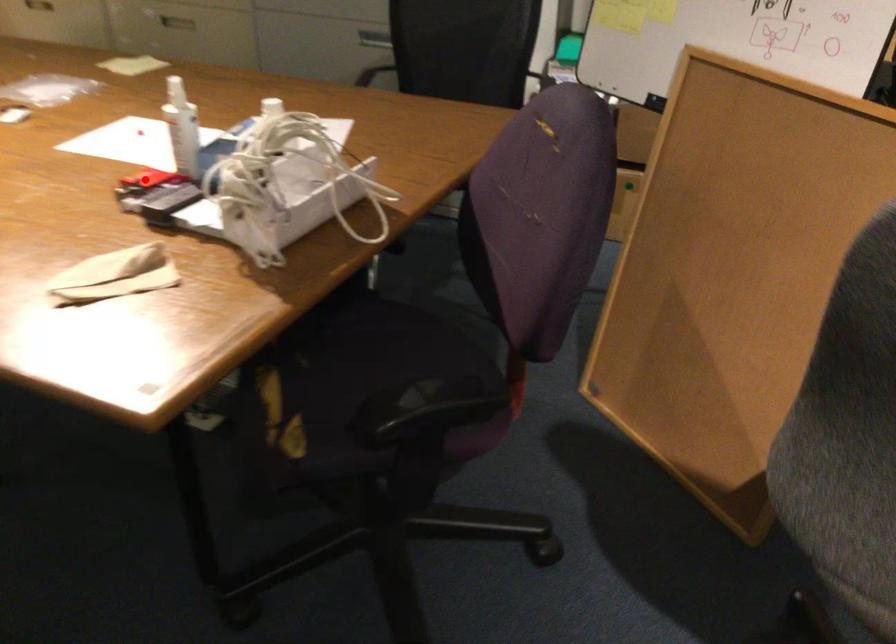
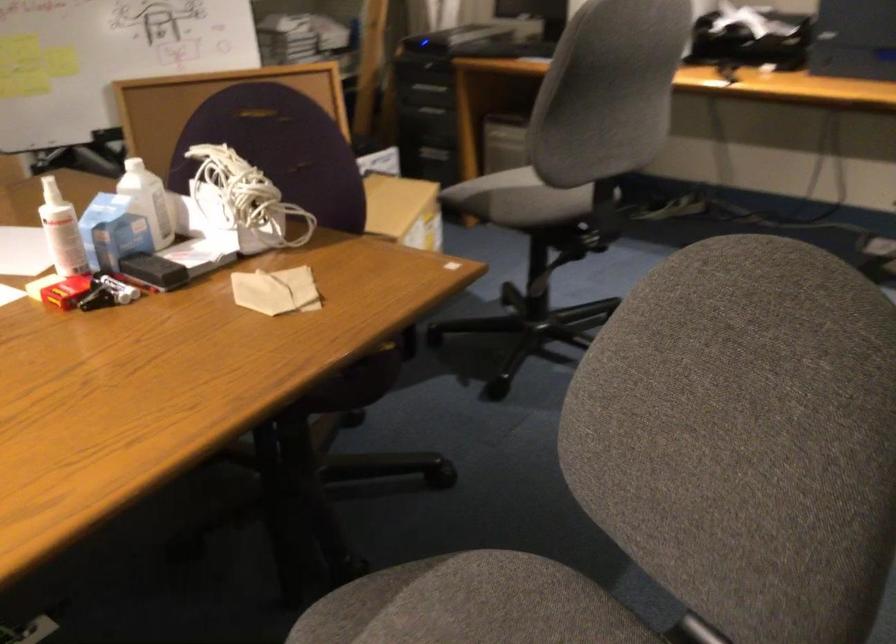
Locate, in the second image, the point that corresponds to the highlighted location in the first image.

(66, 290)